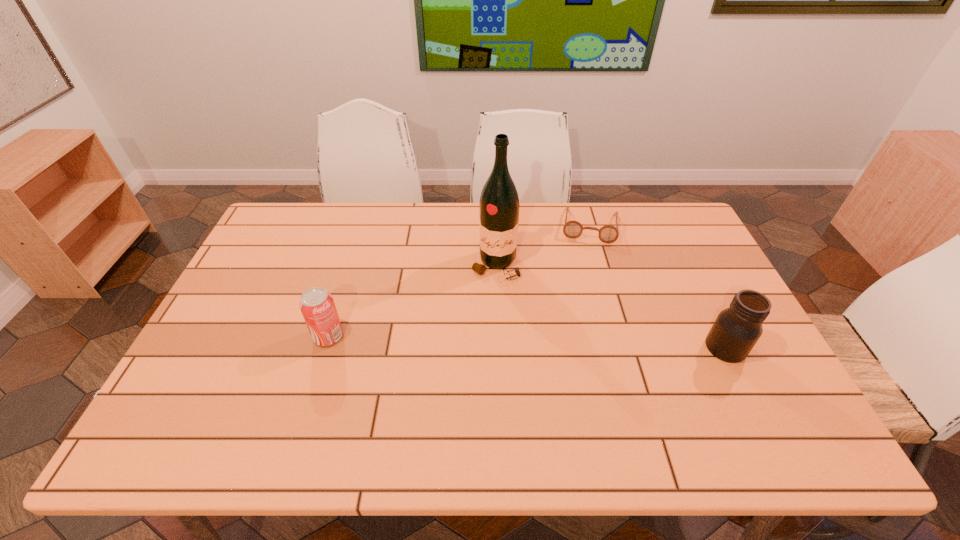
Locate an element on the screen. The image size is (960, 540). free space on the desktop that is between the soda can and the jar and is positioned on the surface of the wine bottle is located at coordinates pyautogui.click(x=476, y=340).

Locate an element on the screen. free spot on the desktop that is between the leftmost object and the rightmost object and is positioned on the front-facing side of the spectacles is located at coordinates (582, 343).